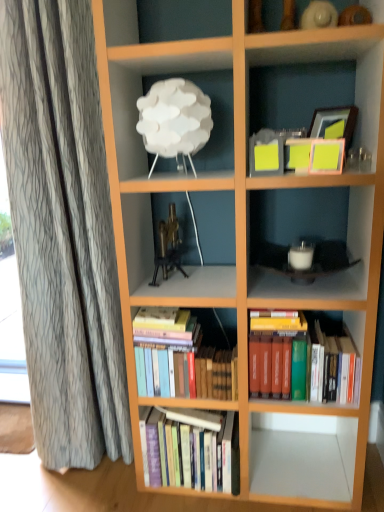
Question: Is gold metallic tripod at center wider than hardcover books at center, which is the second book in bottom-to-top order?

Choices:
 (A) yes
 (B) no

Answer: (A)

Question: Are gold metallic tripod at center and hardcover books at center, which is the second book in bottom-to-top order, making contact?

Choices:
 (A) no
 (B) yes

Answer: (A)

Question: Considering the relative positions of gold metallic tripod at center and hardcover books at center, arranged as the second book when viewed from the top, in the image provided, is gold metallic tripod at center to the right of hardcover books at center, arranged as the second book when viewed from the top, from the viewer's perspective?

Choices:
 (A) no
 (B) yes

Answer: (A)

Question: From the image's perspective, is gold metallic tripod at center above hardcover books at center, which is the second book in bottom-to-top order?

Choices:
 (A) no
 (B) yes

Answer: (B)

Question: Can you confirm if gold metallic tripod at center is thinner than hardcover books at center, arranged as the second book when viewed from the top?

Choices:
 (A) no
 (B) yes

Answer: (A)

Question: In the image, is hardcover books at center, marked as the third book in a top-to-bottom arrangement, on the left side or the right side of hardcover books at center, arranged as the second book when viewed from the top?

Choices:
 (A) left
 (B) right

Answer: (B)

Question: From the image's perspective, is hardcover books at center, marked as the third book in a top-to-bottom arrangement, positioned above or below hardcover books at center, which is the second book in bottom-to-top order?

Choices:
 (A) above
 (B) below

Answer: (B)

Question: Is hardcover books at center, marked as the third book in a top-to-bottom arrangement, situated inside hardcover books at center, arranged as the second book when viewed from the top, or outside?

Choices:
 (A) outside
 (B) inside

Answer: (A)

Question: Is point (233, 458) closer or farther from the camera than point (231, 395)?

Choices:
 (A) farther
 (B) closer

Answer: (A)

Question: Do you think white matte lamp at upper left is within hardcover books at center, which is the third book in bottom-to-top order, or outside of it?

Choices:
 (A) outside
 (B) inside

Answer: (A)

Question: From a real-world perspective, is white matte lamp at upper left physically located above or below hardcover books at center, which is counted as the first book, starting from the top?

Choices:
 (A) above
 (B) below

Answer: (A)

Question: Based on their sizes in the image, would you say white matte lamp at upper left is bigger or smaller than hardcover books at center, which is counted as the first book, starting from the top?

Choices:
 (A) big
 (B) small

Answer: (B)

Question: Would you say white matte lamp at upper left is to the left or to the right of hardcover books at center, which is the third book in bottom-to-top order, in the picture?

Choices:
 (A) right
 (B) left

Answer: (B)

Question: Would you say hardcover books at center, which is the first book in bottom-to-top order, is to the left or to the right of white matte lamp at upper left in the picture?

Choices:
 (A) right
 (B) left

Answer: (A)

Question: From a real-world perspective, is hardcover books at center, marked as the third book in a top-to-bottom arrangement, above or below white matte lamp at upper left?

Choices:
 (A) below
 (B) above

Answer: (A)